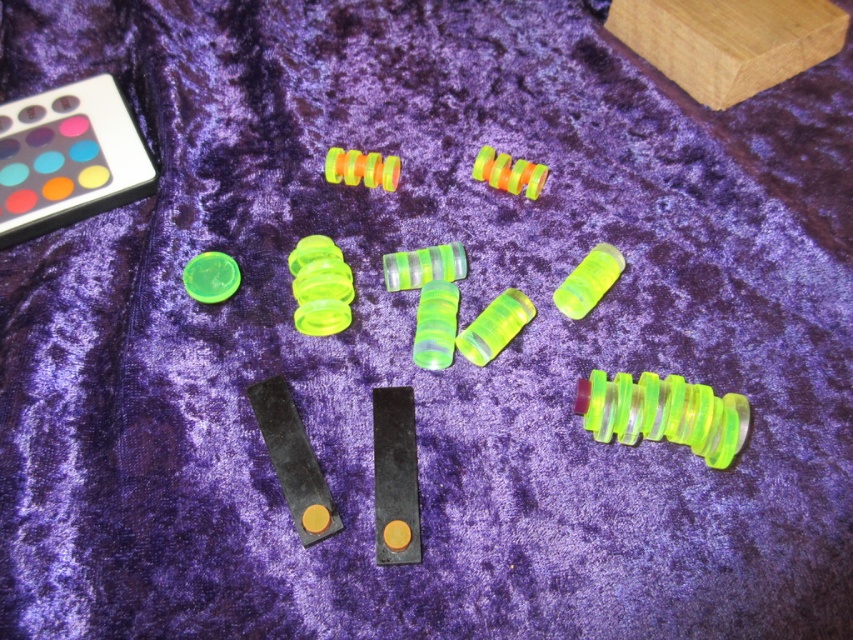
Can you confirm if translucent neon green spring at center-right is positioned above neon plastic spiral at center?

No.

Does point (576, 292) come farther from viewer compared to point (349, 157)?

No, (576, 292) is in front of (349, 157).

Between point (576, 308) and point (341, 160), which one is positioned behind?

The point (341, 160) is more distant.

Locate an element on the screen. This screenshot has width=853, height=640. translucent neon green spring at center-right is located at coordinates (589, 280).

Is translucent green plastic at center positioned at the back of translucent green plastic ring at upper left?

No, it is in front of translucent green plastic ring at upper left.

Who is positioned more to the left, translucent green plastic at center or translucent green plastic ring at upper left?

Positioned to the left is translucent green plastic ring at upper left.

Who is more forward, (727, 461) or (209, 256)?

Point (727, 461) is more forward.

The width and height of the screenshot is (853, 640). In order to click on translucent green plastic at center in this screenshot , I will do `click(663, 413)`.

Is translucent neon green spring at center-right shorter than translucent green plastic ring at upper left?

No.

Does translucent neon green spring at center-right have a smaller size compared to translucent green plastic ring at upper left?

No.

Identify the location of translucent neon green spring at center-right. (589, 280).